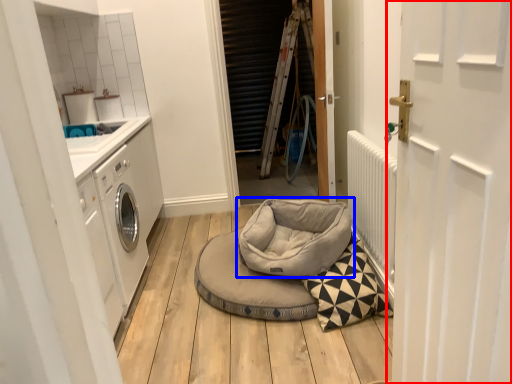
Question: Which object appears closest to the camera in this image, door (highlighted by a red box) or dog bed (highlighted by a blue box)?

Choices:
 (A) door
 (B) dog bed

Answer: (A)